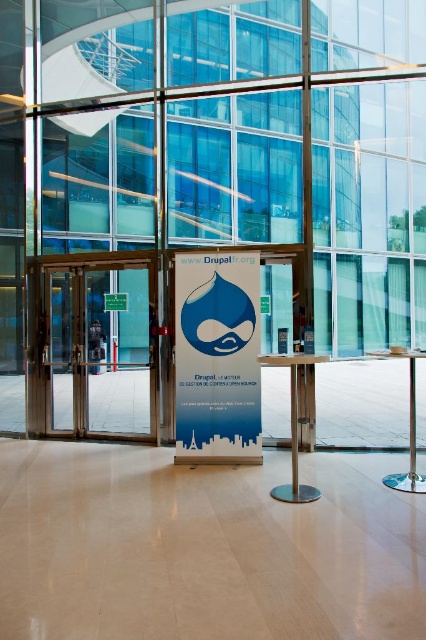
Question: Is transparent glass door at center thinner than blue paper sign at center?

Choices:
 (A) yes
 (B) no

Answer: (B)

Question: In this image, where is blue paper sign at center located relative to green plastic sign at center?

Choices:
 (A) above
 (B) below

Answer: (B)

Question: Based on their relative distances, which object is farther from the transparent glass door at center?

Choices:
 (A) blue paper sign at center
 (B) green plastic sign at center

Answer: (A)

Question: Is transparent glass door at center bigger than blue paper sign at center?

Choices:
 (A) yes
 (B) no

Answer: (A)

Question: Which object is the farthest from the transparent glass door at center?

Choices:
 (A) blue paper sign at center
 (B) green plastic sign at center

Answer: (A)

Question: Which point is farther to the camera?

Choices:
 (A) (63, 364)
 (B) (175, 268)
 (C) (123, 304)

Answer: (A)